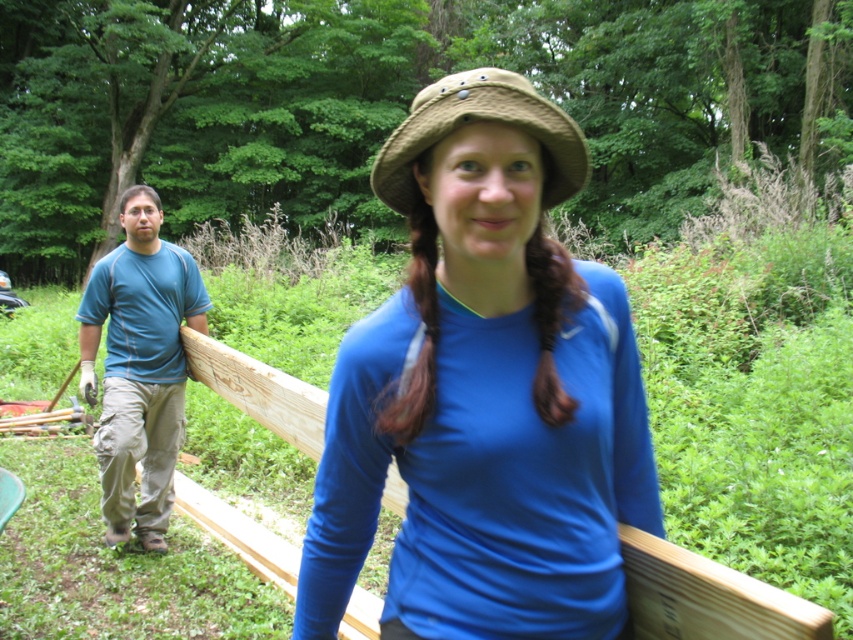
Does blue cotton shirt at left have a larger size compared to tan woven straw hat at center?

Actually, blue cotton shirt at left might be smaller than tan woven straw hat at center.

Which is behind, point (184, 372) or point (527, 88)?

The point (184, 372) is behind.

Measure the distance between point (115, 349) and camera.

The distance of point (115, 349) from camera is 12.96 feet.

Where is `blue cotton shirt at left`? This screenshot has height=640, width=853. blue cotton shirt at left is located at coordinates (138, 365).

Which is more to the left, brown wood fence at left or tan woven straw hat at center?

brown wood fence at left

What do you see at coordinates (709, 596) in the screenshot?
I see `brown wood fence at left` at bounding box center [709, 596].

What do you see at coordinates (709, 596) in the screenshot? I see `brown wood fence at left` at bounding box center [709, 596].

Identify the location of brown wood fence at left. (709, 596).

Between blue matte shirt at center and tan woven straw hat at center, which one is positioned higher?

Positioned higher is tan woven straw hat at center.

Is point (590, 369) farther from viewer compared to point (573, 138)?

Yes, point (590, 369) is farther from viewer.

What are the coordinates of `blue matte shirt at center` in the screenshot? It's located at (485, 392).